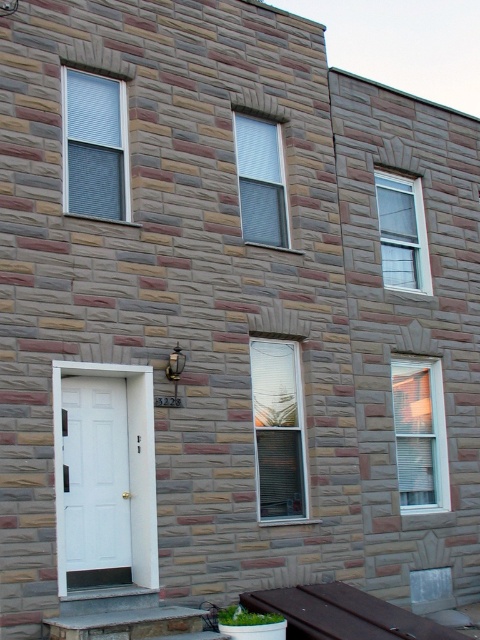
You are standing in front of the two story residential building with a textured brick facade. You need to locate the white matte door at lower left. Where exactly is it positioned in terms of coordinates?

The white matte door at lower left is positioned at coordinates point (96, 481).

You are standing at the front of the building and want to locate two specific points marked on the facade. The first point is at coordinates point (88, 104) and the second point is at point (414, 454). Which point is closer to you?

Point (88, 104) is in front of point (414, 454), so it is closer to you.